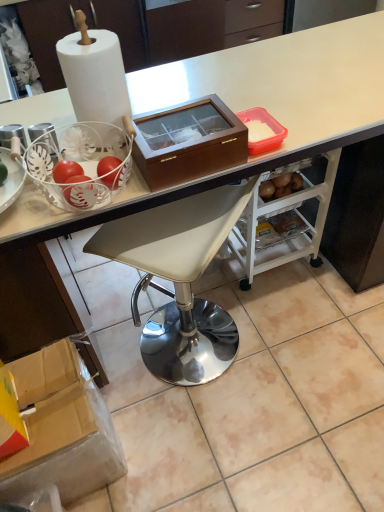
Locate an element on the screen. This screenshot has width=384, height=512. free space in front of white leather stool at center is located at coordinates (210, 438).